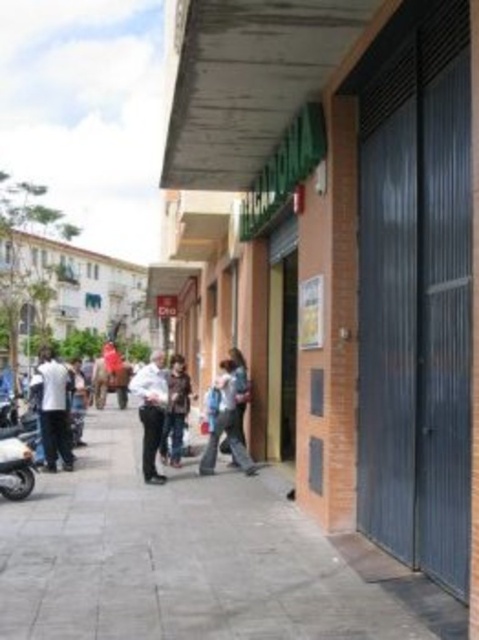
Question: In this image, where is white matte shirt at center located relative to shiny metallic motorcycle at lower left?

Choices:
 (A) below
 (B) above

Answer: (B)

Question: Based on their relative distances, which object is nearer to the white matte shirt at center?

Choices:
 (A) dark brown leather jacket at center
 (B) light brown leather jacket at center
 (C) denim jacket at center
 (D) white matte shirt at left

Answer: (A)

Question: Can you confirm if white matte shirt at left is positioned below light brown leather jacket at center?

Choices:
 (A) no
 (B) yes

Answer: (B)

Question: Which is farther from the shiny metallic motorcycle at lower left?

Choices:
 (A) dark brown leather jacket at center
 (B) denim jacket at center
 (C) white matte shirt at center

Answer: (B)

Question: Is white matte shirt at left bigger than white matte shirt at center?

Choices:
 (A) yes
 (B) no

Answer: (A)

Question: Which point appears farthest from the camera in this image?

Choices:
 (A) click(68, 449)
 (B) click(189, 388)
 (C) click(225, 406)
 (D) click(103, 632)

Answer: (B)